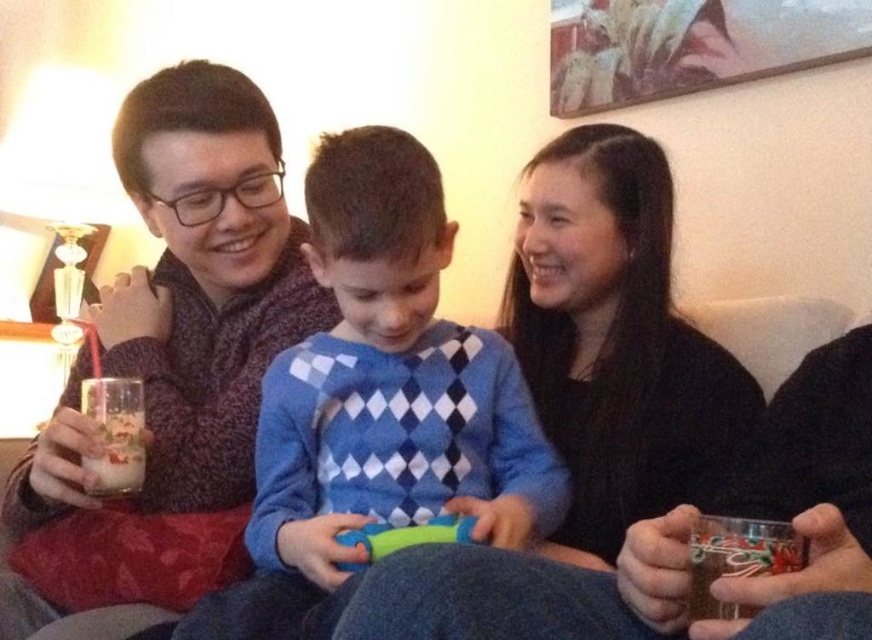
Question: Estimate the real-world distances between objects in this image. Which object is closer to the matte black sweater at left?

Choices:
 (A) black matte sweater at upper center
 (B) green rubber toy at center

Answer: (A)

Question: Which of the following is the closest to the observer?

Choices:
 (A) milky white glass at left
 (B) black matte sweater at upper center

Answer: (B)

Question: Which of the following is the farthest from the observer?

Choices:
 (A) (629, 161)
 (B) (365, 534)

Answer: (A)

Question: From the image, what is the correct spatial relationship of black matte sweater at upper center in relation to green rubber toy at center?

Choices:
 (A) left
 (B) right

Answer: (B)

Question: Does blue diamond-patterned sweater at center come behind green rubber toy at center?

Choices:
 (A) no
 (B) yes

Answer: (A)

Question: Does blue diamond-patterned sweater at center appear over green rubber toy at center?

Choices:
 (A) yes
 (B) no

Answer: (A)